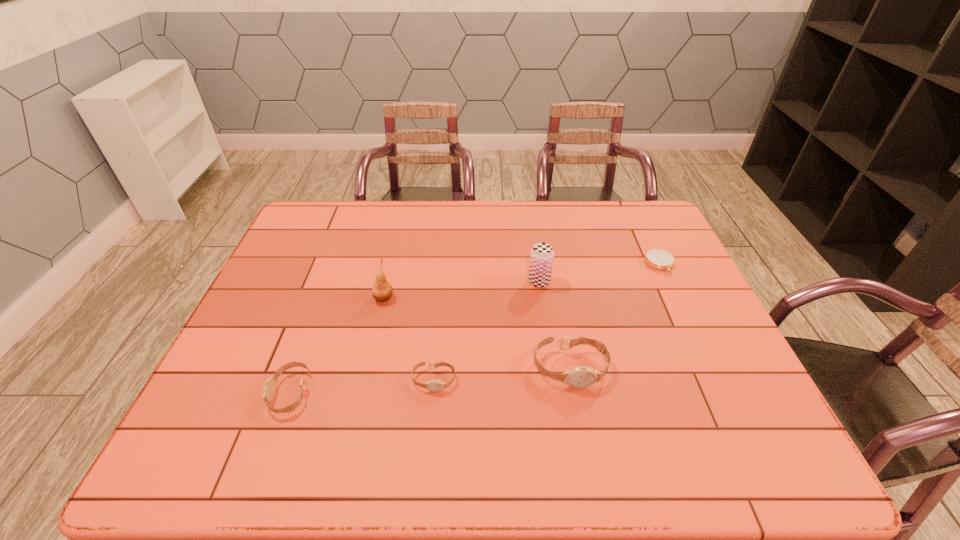
The image size is (960, 540). What are the coordinates of `object located at the near left corner` in the screenshot? It's located at (269, 389).

Locate an element on the screen. The height and width of the screenshot is (540, 960). free space at the far edge is located at coordinates (364, 228).

Where is `free location at the near edge`? This screenshot has height=540, width=960. free location at the near edge is located at coordinates (631, 421).

I want to click on vacant region at the left edge of the desktop, so click(232, 348).

Where is `vacant space at the right edge`? vacant space at the right edge is located at coordinates 642,269.

This screenshot has height=540, width=960. I want to click on blank area at the far left corner, so click(x=326, y=236).

Where is `free area in between the shortest object and the pear`? Image resolution: width=960 pixels, height=540 pixels. free area in between the shortest object and the pear is located at coordinates (522, 281).

Where is `unoccupied position between the shortest watch and the beer can`? The width and height of the screenshot is (960, 540). unoccupied position between the shortest watch and the beer can is located at coordinates (487, 330).

The width and height of the screenshot is (960, 540). Find the location of `vacant space that is in between the second shortest watch and the shortest object`. vacant space that is in between the second shortest watch and the shortest object is located at coordinates (475, 329).

Locate an element on the screen. This screenshot has width=960, height=540. vacant area between the pear and the fourth object from right to left is located at coordinates (409, 339).